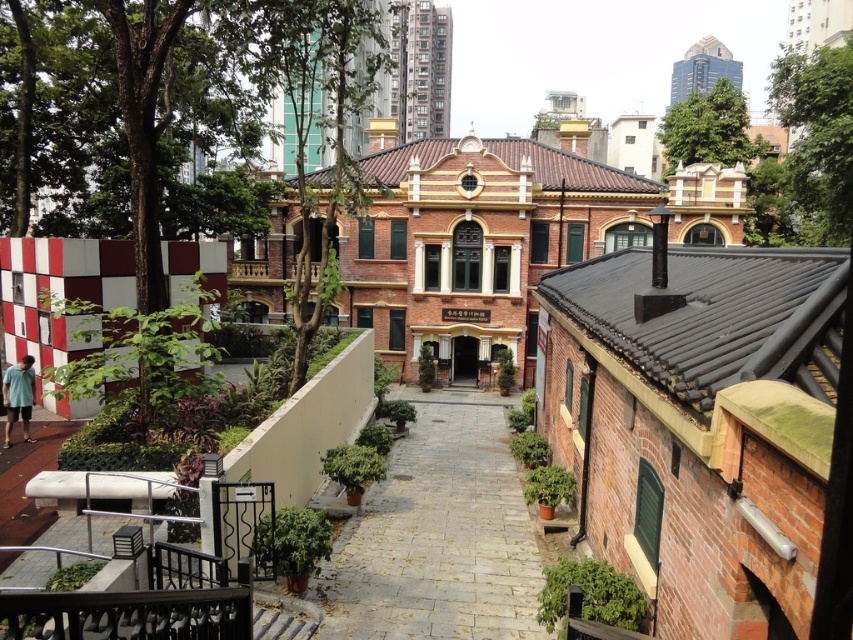
You are planning to walk through the courtyard and need to know if the gray stone path at center is wide enough for two people to walk side by side. Can you determine this based on the light blue cotton shirt at lower left?

The gray stone path at center is wider than the light blue cotton shirt at lower left. Since the shirt is likely narrower than two people side by side, the path might be wide enough, but this comparison alone isn

You are a tourist visiting the courtyard and want to take a photo of both the gray stone path at center and the light blue cotton shirt at lower left. Which object should you focus on first if you want to capture both in one frame without moving the camera?

You should focus on the gray stone path at center first because it is larger in size than the light blue cotton shirt at lower left, allowing it to be more prominently featured in the frame while still including the smaller object.

You are standing in the courtyard and want to walk towards the entrance marked by the large arched doorway. Which direction should you head relative to the gray stone path at center?

The gray stone path at center is located at point (438, 534), so you should head towards the entrance by following the gray stone path at center which is positioned centrally in the courtyard leading towards the entrance.